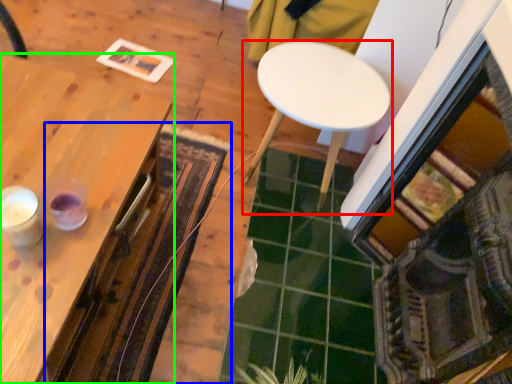
Question: Estimate the real-world distances between objects in this image. Which object is closer to table (highlighted by a red box), mat (highlighted by a blue box) or table (highlighted by a green box)?

Choices:
 (A) mat
 (B) table

Answer: (A)